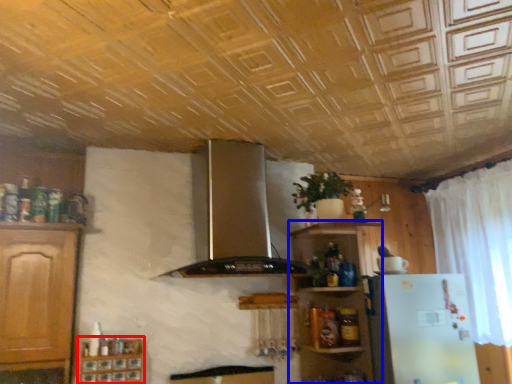
Question: Which object appears farthest to the camera in this image, cabinetry (highlighted by a red box) or shelf (highlighted by a blue box)?

Choices:
 (A) cabinetry
 (B) shelf

Answer: (B)